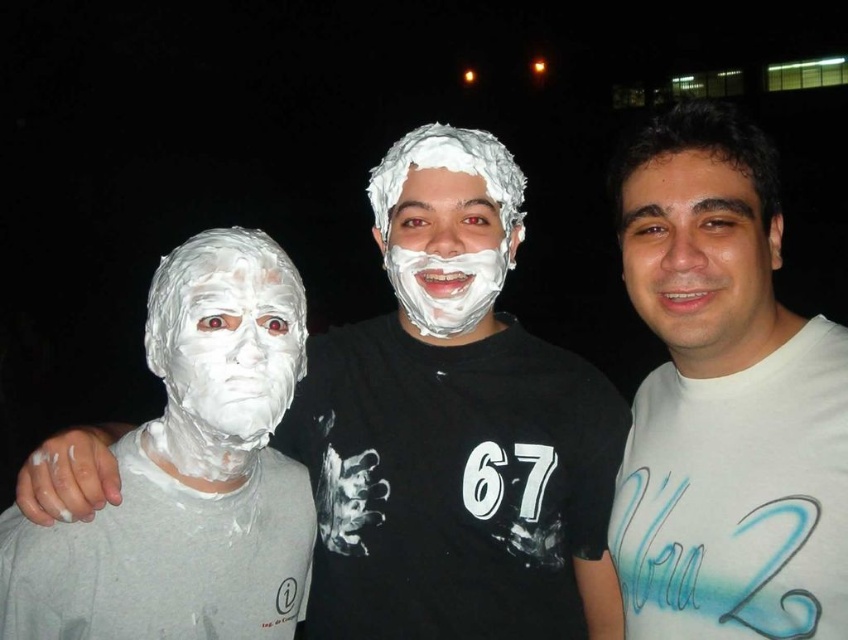
Which is above, white matte face paint at left or smooth skin face at center?

smooth skin face at center is above.

Who is lower down, white matte face paint at left or smooth skin face at center?

white matte face paint at left is below.

I want to click on white matte face paint at left, so click(455, 429).

Find the location of a particular element. This screenshot has height=640, width=848. white matte face paint at left is located at coordinates (455, 429).

Between white matte face paint at left and white foam face at center, which one has less height?

white foam face at center

Is white matte face paint at left behind white foam face at center?

No, it is not.

Who is more forward, [428,253] or [420,196]?

Positioned in front is point [428,253].

Locate an element on the screen. The width and height of the screenshot is (848, 640). white matte face paint at left is located at coordinates (455, 429).

Is white matte shirt at center wider than white foam face at center?

Correct, the width of white matte shirt at center exceeds that of white foam face at center.

Does white matte shirt at center appear under white foam face at center?

Correct, white matte shirt at center is located below white foam face at center.

What do you see at coordinates (724, 401) in the screenshot?
I see `white matte shirt at center` at bounding box center [724, 401].

Image resolution: width=848 pixels, height=640 pixels. I want to click on white matte shirt at center, so click(724, 401).